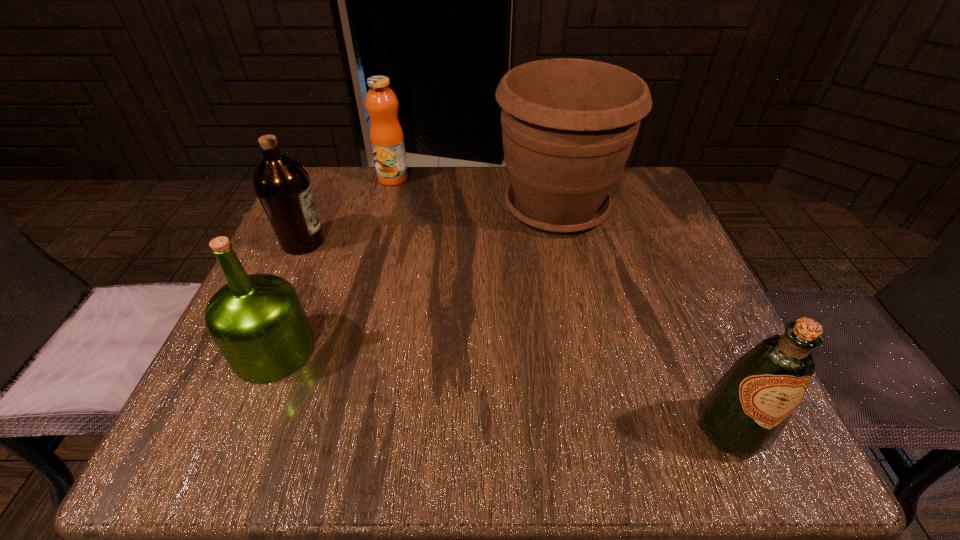
The height and width of the screenshot is (540, 960). In the image, there is a desktop. Identify the location of vacant space at the right edge. (654, 252).

Find the location of `vacant space at the far left corner`. vacant space at the far left corner is located at coordinates (363, 170).

Where is `free space at the far right corner of the desktop`? free space at the far right corner of the desktop is located at coordinates (635, 198).

In the image, there is a desktop. Identify the location of vacant region at the near right corner. (723, 453).

The image size is (960, 540). Find the location of `vacant space that is in between the flowerpot and the nearest olive oil`. vacant space that is in between the flowerpot and the nearest olive oil is located at coordinates (643, 319).

Locate an element on the screen. The height and width of the screenshot is (540, 960). vacant point located between the flowerpot and the fruit juice is located at coordinates (475, 193).

What are the coordinates of `free point between the fruit juice and the flowerpot` in the screenshot? It's located at (475, 193).

This screenshot has height=540, width=960. I want to click on free space between the fruit juice and the second farthest olive oil, so click(x=334, y=264).

The height and width of the screenshot is (540, 960). Find the location of `unoccupied position between the farthest olive oil and the nearest olive oil`. unoccupied position between the farthest olive oil and the nearest olive oil is located at coordinates (516, 335).

Find the location of a particular element. The width and height of the screenshot is (960, 540). free space between the flowerpot and the second farthest olive oil is located at coordinates (416, 279).